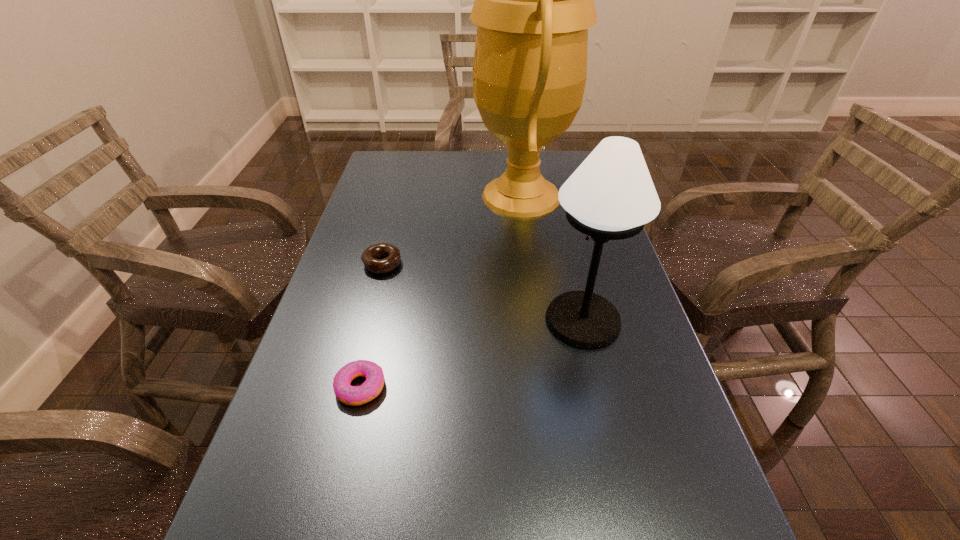
Locate an element on the screen. vacant point located between the farther doughnut and the third farthest object is located at coordinates (482, 292).

At what (x,y) coordinates should I click in order to perform the action: click on unoccupied position between the nearest object and the farther doughnut. Please return your answer as a coordinate pair (x, y). Looking at the image, I should click on (372, 326).

Identify the location of free area in between the third farthest object and the nearer doughnut. The image size is (960, 540). (471, 354).

This screenshot has width=960, height=540. Find the location of `empty location between the farther doughnut and the third farthest object`. empty location between the farther doughnut and the third farthest object is located at coordinates (482, 292).

Locate an element on the screen. vacant area that lies between the nearest object and the farther doughnut is located at coordinates (372, 326).

Locate an element on the screen. This screenshot has width=960, height=540. unoccupied position between the farther doughnut and the third farthest object is located at coordinates (482, 292).

Identify which object is located as the nearest to the trophy. Please provide its 2D coordinates. Your answer should be formatted as a tuple, i.e. [(x, y)], where the tuple contains the x and y coordinates of a point satisfying the conditions above.

[(611, 196)]

This screenshot has height=540, width=960. Identify the location of object that is the third closest to the nearer doughnut. (534, 0).

Identify which doughnut is the nearest to the third farthest object. Please provide its 2D coordinates. Your answer should be formatted as a tuple, i.e. [(x, y)], where the tuple contains the x and y coordinates of a point satisfying the conditions above.

[(350, 395)]

Find the location of a particular element. The height and width of the screenshot is (540, 960). free region that satisfies the following two spatial constraints: 1. on the engravings side of the second tallest object; 2. on the right side of the trophy is located at coordinates (539, 320).